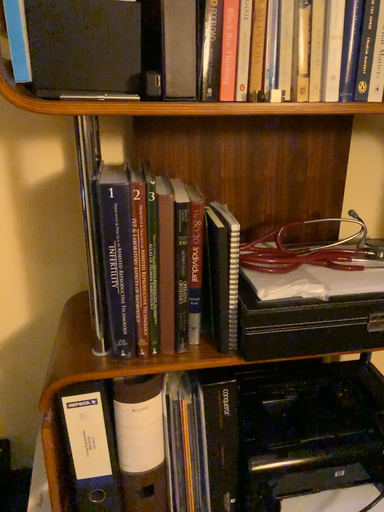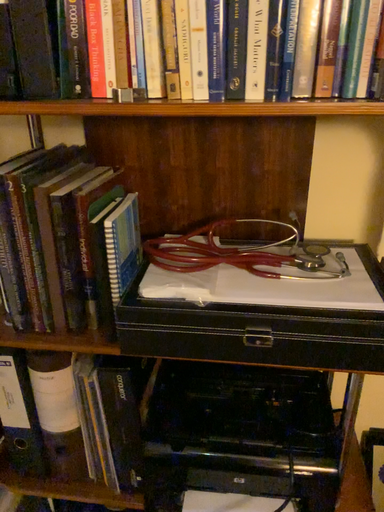
Question: How did the camera likely rotate when shooting the video?

Choices:
 (A) rotated left
 (B) rotated right

Answer: (A)